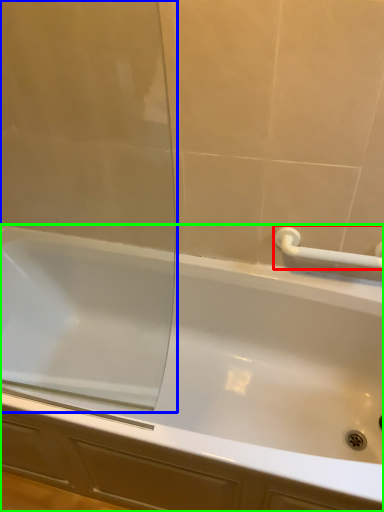
Question: Estimate the real-world distances between objects in this image. Which object is farther from towel bar (highlighted by a red box), screen door (highlighted by a blue box) or bathtub (highlighted by a green box)?

Choices:
 (A) screen door
 (B) bathtub

Answer: (A)